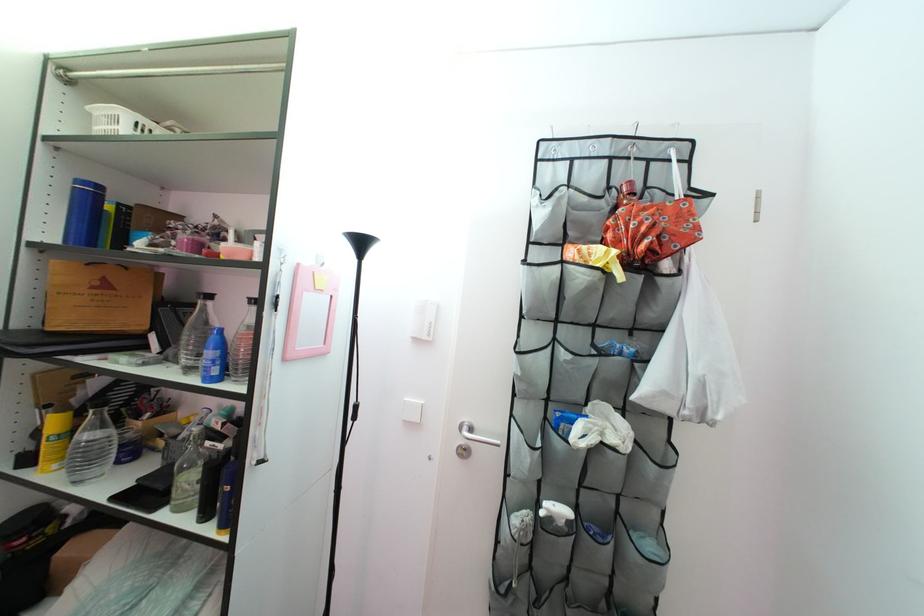
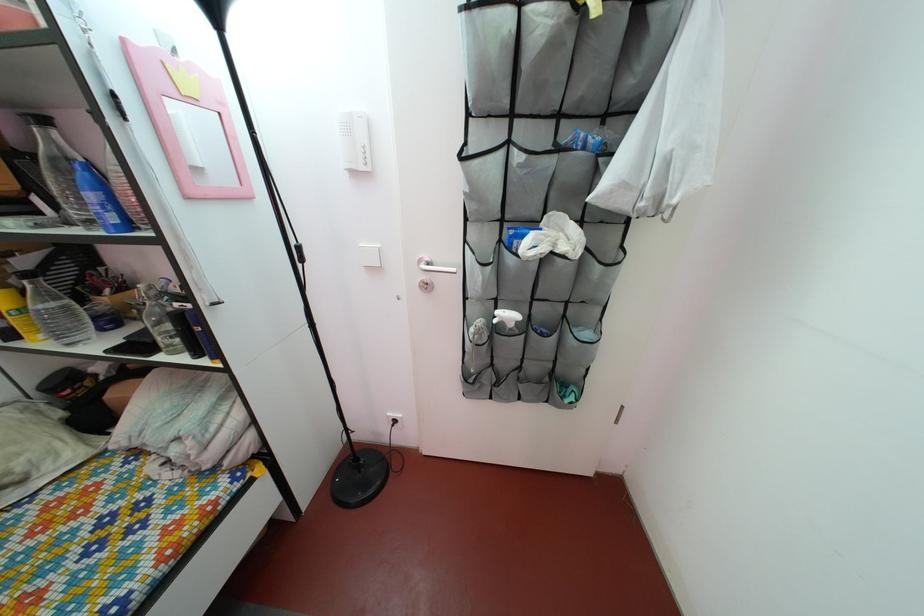
Where in the second image is the point corresponding to pixel 106 391 from the first image?

(32, 270)